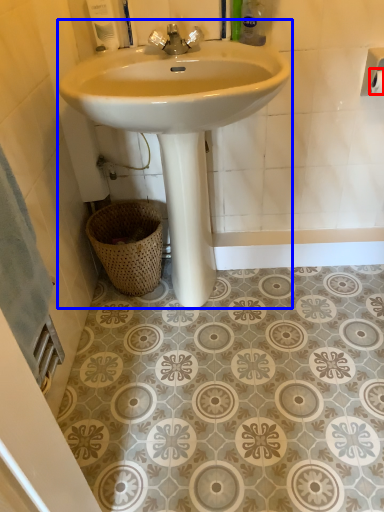
Question: Which object appears farthest to the camera in this image, toilet paper (highlighted by a red box) or sink (highlighted by a blue box)?

Choices:
 (A) toilet paper
 (B) sink

Answer: (A)